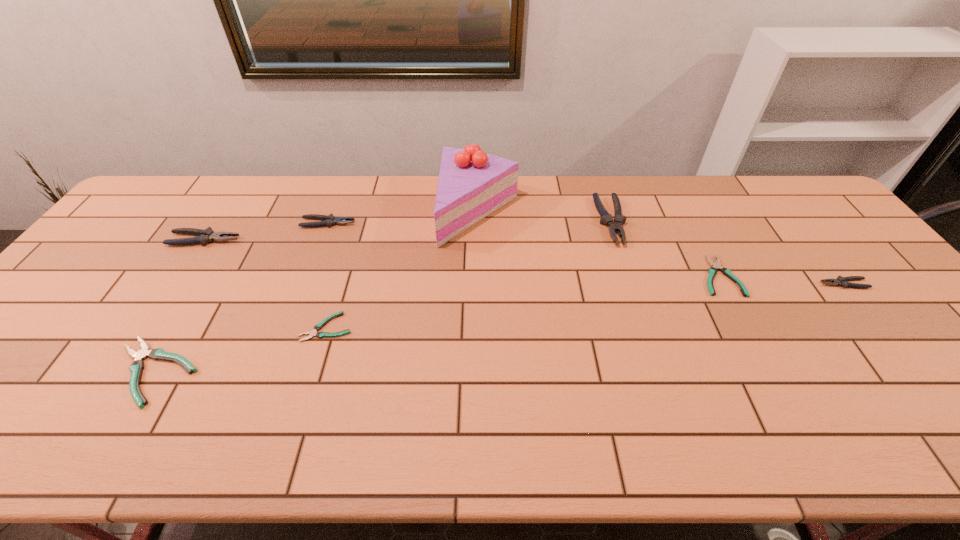
Find the location of a particular element. The width and height of the screenshot is (960, 540). vacant space at the right edge of the desktop is located at coordinates (834, 240).

Where is `vacant space that is in between the sixth tallest object and the rightmost object`? vacant space that is in between the sixth tallest object and the rightmost object is located at coordinates (498, 328).

Find the location of `free spot between the cake and the third tallest pliers`. free spot between the cake and the third tallest pliers is located at coordinates (x=403, y=217).

Image resolution: width=960 pixels, height=540 pixels. In order to click on unoccupied area between the second gray pliers from left to right and the second tallest pliers in this screenshot , I will do `click(266, 232)`.

Where is `vacant area that lies between the second tallest object and the second teal pliers from left to right`? The width and height of the screenshot is (960, 540). vacant area that lies between the second tallest object and the second teal pliers from left to right is located at coordinates (468, 274).

The height and width of the screenshot is (540, 960). I want to click on vacant space that is in between the third shortest pliers and the seventh object from left to right, so click(x=436, y=324).

Image resolution: width=960 pixels, height=540 pixels. Find the location of `unoccupied position between the tallest pliers and the third smallest gray pliers`. unoccupied position between the tallest pliers and the third smallest gray pliers is located at coordinates (408, 231).

Find the location of a particular element. The width and height of the screenshot is (960, 540). free space between the nearest gray pliers and the fourth tallest object is located at coordinates (586, 254).

This screenshot has height=540, width=960. What are the coordinates of `vacant space that's between the shortest object and the second biggest gray pliers` in the screenshot? It's located at (266, 284).

Where is `vacant space that is in between the shortest object and the third shortest object`? The height and width of the screenshot is (540, 960). vacant space that is in between the shortest object and the third shortest object is located at coordinates 240,349.